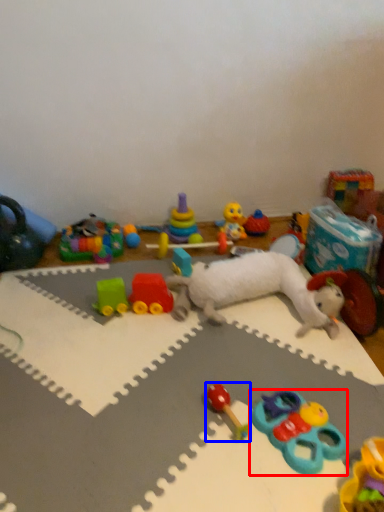
Question: Which of the following is the closest to the observer, toy (highlighted by a red box) or toy (highlighted by a blue box)?

Choices:
 (A) toy
 (B) toy

Answer: (A)